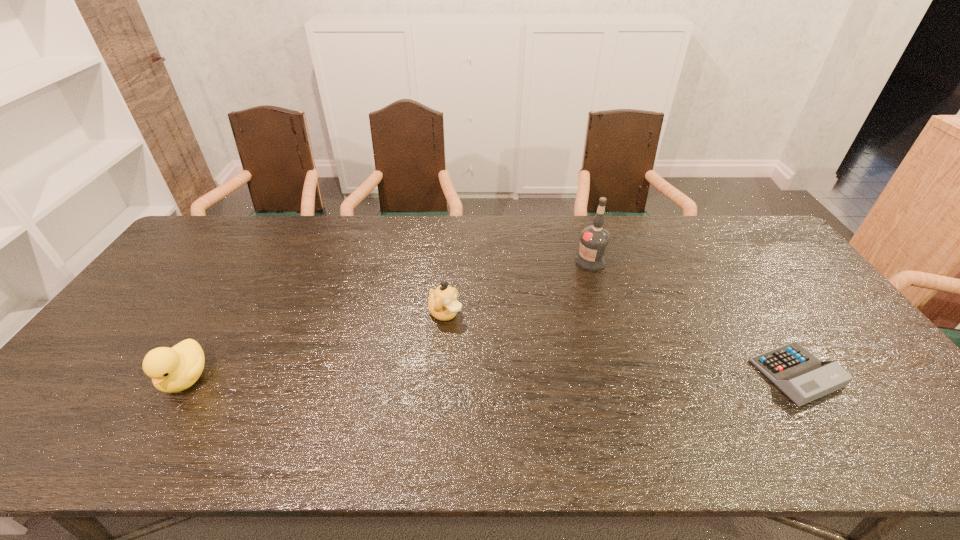
Locate an element on the screen. The height and width of the screenshot is (540, 960). free space at the near edge of the desktop is located at coordinates (333, 389).

In the image, there is a desktop. Where is `vacant space at the right edge`? This screenshot has width=960, height=540. vacant space at the right edge is located at coordinates (757, 286).

In the image, there is a desktop. Find the location of `vacant space at the far left corner`. vacant space at the far left corner is located at coordinates (203, 247).

What are the coordinates of `vacant region at the far right corner of the desktop` in the screenshot? It's located at (734, 244).

You are a GUI agent. You are given a task and a screenshot of the screen. Output one action in this format:
    pyautogui.click(x=<x>, y=<y>)
    Task: Click on the vacant space that is in between the second object from right to left and the second object from left to right
    
    Given the screenshot: What is the action you would take?
    pyautogui.click(x=517, y=288)

I want to click on free space between the duck and the second farthest object, so pos(316,346).

At what (x,y) coordinates should I click in order to perform the action: click on empty space that is in between the farthest object and the second farthest object. Please return your answer as a coordinate pair (x, y). Image resolution: width=960 pixels, height=540 pixels. Looking at the image, I should click on (517, 288).

What are the coordinates of `vacant point located between the farthest object and the duck` in the screenshot? It's located at (388, 320).

Find the location of a particular element. Image resolution: width=960 pixels, height=540 pixels. free point between the rightmost object and the duck is located at coordinates (491, 376).

Find the location of a particular element. The image size is (960, 540). unoccupied area between the leftmost object and the farthest object is located at coordinates (388, 320).